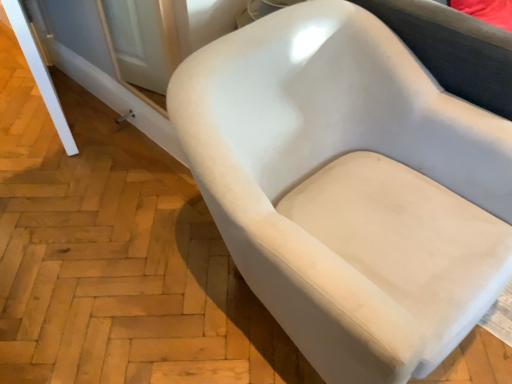
Find the location of a particular element. The width and height of the screenshot is (512, 384). vacant space to the left of white fabric chair at center is located at coordinates (121, 258).